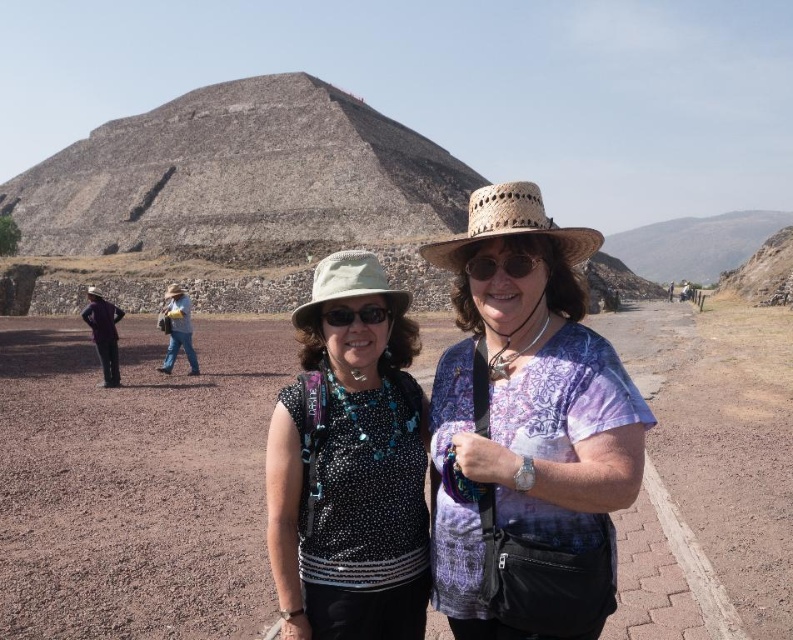
You are a photographer planning to take a group photo of the two people in the scene. You need to position them so that the person wearing the polka dot fabric shirt at center and the person in denim jeans at center are both visible. Since the pyramid is in the background, which person should stand closer to the camera to avoid being blocked by the other?

The polka dot fabric shirt at center is taller than denim jeans at center, so the denim jeans at center should stand closer to the camera to avoid being blocked by the taller person.

You are standing at point [489,516] and want to take a photo of the Pyramid of the Sun. If your camera is 30.78 meters away from you, will you be able to capture the entire pyramid in the frame?

Yes, since the camera is exactly 30.78 meters away from point [489,516], which is the required distance to capture the entire pyramid in the frame.